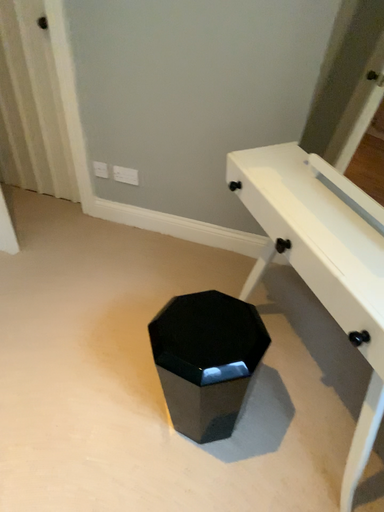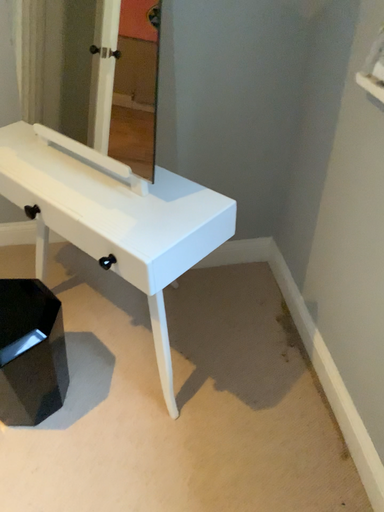
Question: How did the camera likely rotate when shooting the video?

Choices:
 (A) rotated left
 (B) rotated right

Answer: (B)